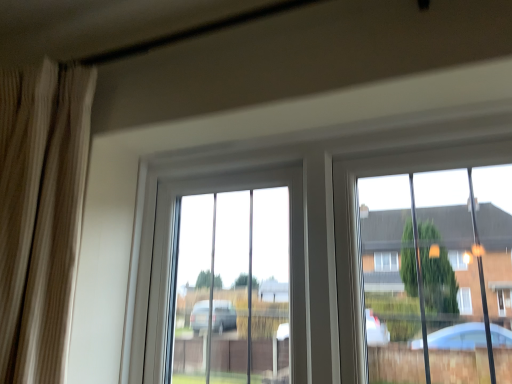
What is the approximate width of beige textured curtain at left?

It is 16.76 centimeters.

You are a GUI agent. You are given a task and a screenshot of the screen. Output one action in this format:
    pyautogui.click(x=<x>, y=<y>)
    Task: Click on the beige textured curtain at left
    This screenshot has height=384, width=512.
    Given the screenshot: What is the action you would take?
    pyautogui.click(x=40, y=214)

What do you see at coordinates (40, 214) in the screenshot?
I see `beige textured curtain at left` at bounding box center [40, 214].

In order to face beige textured curtain at left, should I rotate leftwards or rightwards?

Turn left by 30.103 degrees to look at beige textured curtain at left.

Locate an element on the screen. The image size is (512, 384). beige textured curtain at left is located at coordinates (40, 214).